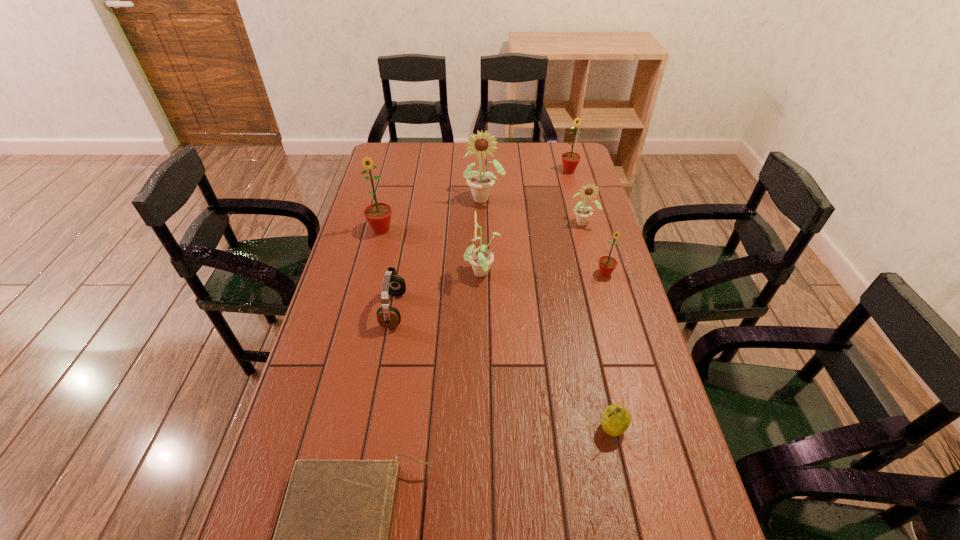
Locate an element on the screen. vacant space situated on the front-facing side of the rightmost yellow sunflower is located at coordinates (600, 288).

Locate an element on the screen. The height and width of the screenshot is (540, 960). free space located on the face of the nearest green sunflower is located at coordinates (x=611, y=293).

The width and height of the screenshot is (960, 540). In order to click on free location located 0.230m on the ear cups of the headset in this screenshot , I will do click(x=482, y=310).

In order to click on blank space located 0.340m on the back of the eighth tallest object in this screenshot , I will do `click(586, 310)`.

Identify the location of object that is at the far edge. (570, 160).

The width and height of the screenshot is (960, 540). Identify the location of object that is at the left edge. (378, 215).

Locate an element on the screen. This screenshot has width=960, height=540. pear present at the right edge is located at coordinates (615, 420).

Where is `object situated at the far right corner`? Image resolution: width=960 pixels, height=540 pixels. object situated at the far right corner is located at coordinates (570, 160).

This screenshot has width=960, height=540. I want to click on vacant space at the far edge, so click(x=445, y=148).

Where is `vacant region at the left edge of the desktop`? The height and width of the screenshot is (540, 960). vacant region at the left edge of the desktop is located at coordinates (318, 429).